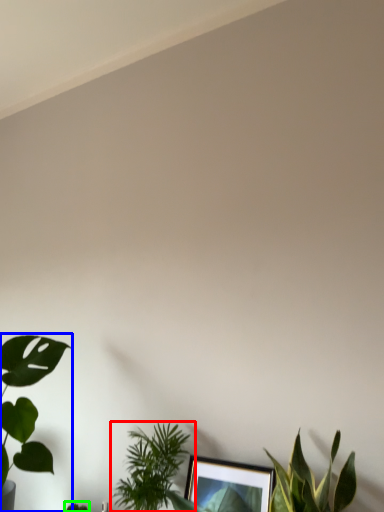
Question: Which object is positioned farthest from houseplant (highlighted by a red box)? Select from houseplant (highlighted by a blue box) and plant (highlighted by a green box).

Choices:
 (A) houseplant
 (B) plant

Answer: (B)